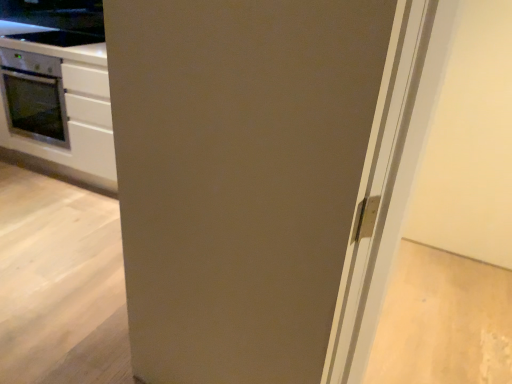
Question: Is there a large distance between smooth black countertop at upper left and white glossy cabinet at left?

Choices:
 (A) yes
 (B) no

Answer: (B)

Question: From the image's perspective, is smooth black countertop at upper left below white glossy cabinet at left?

Choices:
 (A) no
 (B) yes

Answer: (A)

Question: Is white glossy cabinet at left at the back of smooth black countertop at upper left?

Choices:
 (A) yes
 (B) no

Answer: (B)

Question: Is smooth black countertop at upper left facing towards white glossy cabinet at left?

Choices:
 (A) yes
 (B) no

Answer: (B)

Question: Is smooth black countertop at upper left touching white glossy cabinet at left?

Choices:
 (A) no
 (B) yes

Answer: (A)

Question: Is smooth black countertop at upper left wider than white glossy cabinet at left?

Choices:
 (A) no
 (B) yes

Answer: (A)

Question: Considering the relative sizes of white glossy cabinet at left and matte gray door at center in the image provided, is white glossy cabinet at left shorter than matte gray door at center?

Choices:
 (A) no
 (B) yes

Answer: (B)

Question: Is white glossy cabinet at left looking in the opposite direction of matte gray door at center?

Choices:
 (A) no
 (B) yes

Answer: (A)

Question: From the image's perspective, is white glossy cabinet at left over matte gray door at center?

Choices:
 (A) yes
 (B) no

Answer: (A)

Question: Is white glossy cabinet at left facing towards matte gray door at center?

Choices:
 (A) yes
 (B) no

Answer: (B)

Question: Can you confirm if white glossy cabinet at left is bigger than matte gray door at center?

Choices:
 (A) no
 (B) yes

Answer: (B)

Question: From a real-world perspective, is white glossy cabinet at left beneath matte gray door at center?

Choices:
 (A) yes
 (B) no

Answer: (A)

Question: Is matte gray door at center positioned far away from smooth black countertop at upper left?

Choices:
 (A) yes
 (B) no

Answer: (A)